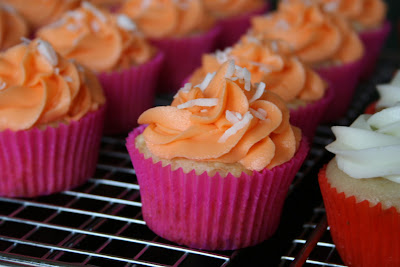
You are a GUI agent. You are given a task and a screenshot of the screen. Output one action in this format:
    pyautogui.click(x=<x>, y=<y>)
    Task: Click on the cup
    
    Given the screenshot: What is the action you would take?
    pyautogui.click(x=186, y=223)